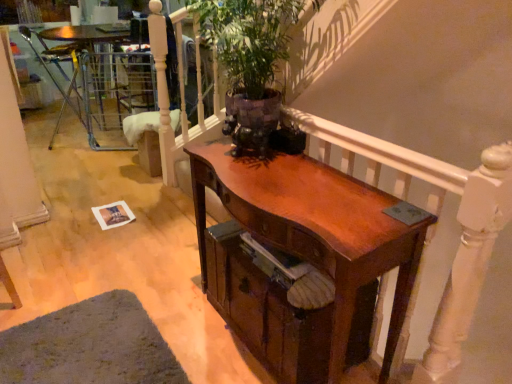
Question: Is wooden drawer at center turned away from green leafy plant at upper center?

Choices:
 (A) yes
 (B) no

Answer: (B)

Question: Can we say wooden drawer at center lies outside green leafy plant at upper center?

Choices:
 (A) no
 (B) yes

Answer: (B)

Question: Are wooden drawer at center and green leafy plant at upper center beside each other?

Choices:
 (A) no
 (B) yes

Answer: (A)

Question: Would you say green leafy plant at upper center is part of wooden drawer at center's contents?

Choices:
 (A) yes
 (B) no

Answer: (B)

Question: Is the depth of wooden drawer at center less than that of green leafy plant at upper center?

Choices:
 (A) no
 (B) yes

Answer: (A)

Question: Is wooden drawer at center thinner than green leafy plant at upper center?

Choices:
 (A) no
 (B) yes

Answer: (A)

Question: Is shiny brown desk at center smaller than metallic silver chair at left?

Choices:
 (A) no
 (B) yes

Answer: (A)

Question: From the image's perspective, would you say shiny brown desk at center is positioned over metallic silver chair at left?

Choices:
 (A) no
 (B) yes

Answer: (A)

Question: Can you confirm if shiny brown desk at center is shorter than metallic silver chair at left?

Choices:
 (A) yes
 (B) no

Answer: (A)

Question: Is shiny brown desk at center oriented away from metallic silver chair at left?

Choices:
 (A) no
 (B) yes

Answer: (A)

Question: Would you say shiny brown desk at center is a long distance from metallic silver chair at left?

Choices:
 (A) no
 (B) yes

Answer: (B)

Question: From the image's perspective, is shiny brown desk at center beneath metallic silver chair at left?

Choices:
 (A) yes
 (B) no

Answer: (A)

Question: From the image's perspective, is shiny brown desk at center above wooden drawer at center?

Choices:
 (A) yes
 (B) no

Answer: (A)